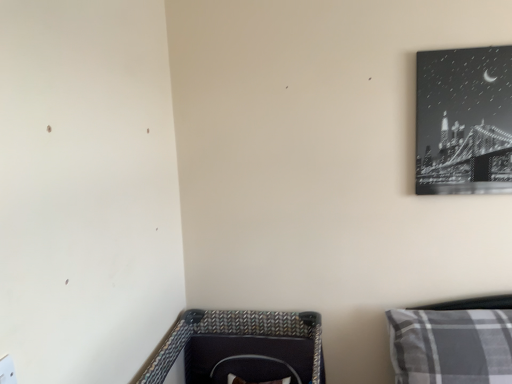
Question: From their relative heights in the image, would you say gray plaid pillow at lower right is taller or shorter than black glossy canvas at upper right?

Choices:
 (A) tall
 (B) short

Answer: (B)

Question: Looking at the image, does gray plaid pillow at lower right seem bigger or smaller compared to black glossy canvas at upper right?

Choices:
 (A) big
 (B) small

Answer: (A)

Question: Is point (444, 362) closer or farther from the camera than point (462, 130)?

Choices:
 (A) farther
 (B) closer

Answer: (B)

Question: Would you say black glossy canvas at upper right is to the left or to the right of gray plaid pillow at lower right in the picture?

Choices:
 (A) left
 (B) right

Answer: (B)

Question: In terms of height, does black glossy canvas at upper right look taller or shorter compared to gray plaid pillow at lower right?

Choices:
 (A) tall
 (B) short

Answer: (A)

Question: In the image, is black glossy canvas at upper right positioned in front of or behind gray plaid pillow at lower right?

Choices:
 (A) front
 (B) behind

Answer: (B)

Question: Is black glossy canvas at upper right inside the boundaries of gray plaid pillow at lower right, or outside?

Choices:
 (A) inside
 (B) outside

Answer: (B)